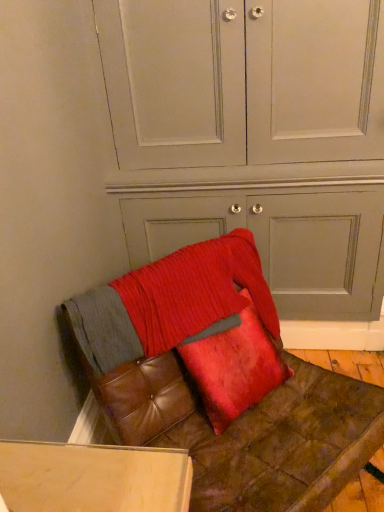
Question: From the image's perspective, is leather cushion at lower right below velvet red pillow at center?

Choices:
 (A) no
 (B) yes

Answer: (B)

Question: Does leather cushion at lower right have a greater width compared to velvet red pillow at center?

Choices:
 (A) no
 (B) yes

Answer: (B)

Question: Is velvet red pillow at center at the back of leather cushion at lower right?

Choices:
 (A) no
 (B) yes

Answer: (B)

Question: Can you confirm if leather cushion at lower right is taller than velvet red pillow at center?

Choices:
 (A) no
 (B) yes

Answer: (B)

Question: Is velvet red pillow at center a part of leather cushion at lower right?

Choices:
 (A) yes
 (B) no

Answer: (A)

Question: Considering the positions of point (221, 442) and point (375, 81), is point (221, 442) closer or farther from the camera than point (375, 81)?

Choices:
 (A) farther
 (B) closer

Answer: (B)

Question: Considering the positions of leather cushion at lower right and matte gray dresser at center in the image, is leather cushion at lower right wider or thinner than matte gray dresser at center?

Choices:
 (A) wide
 (B) thin

Answer: (A)

Question: Which is correct: leather cushion at lower right is inside matte gray dresser at center, or outside of it?

Choices:
 (A) inside
 (B) outside

Answer: (B)

Question: Relative to matte gray dresser at center, is leather cushion at lower right in front or behind?

Choices:
 (A) front
 (B) behind

Answer: (A)

Question: Does point (165, 431) appear closer or farther from the camera than point (211, 373)?

Choices:
 (A) farther
 (B) closer

Answer: (A)

Question: In terms of width, does leather cushion at lower right look wider or thinner when compared to velvet red pillow at center?

Choices:
 (A) wide
 (B) thin

Answer: (A)

Question: Relative to velvet red pillow at center, is leather cushion at lower right in front or behind?

Choices:
 (A) behind
 (B) front

Answer: (B)

Question: Which is correct: leather cushion at lower right is inside velvet red pillow at center, or outside of it?

Choices:
 (A) inside
 (B) outside

Answer: (B)

Question: Considering their positions, is velvet red pillow at center located in front of or behind leather cushion at lower right?

Choices:
 (A) behind
 (B) front

Answer: (A)

Question: Considering the positions of velvet red pillow at center and leather cushion at lower right in the image, is velvet red pillow at center taller or shorter than leather cushion at lower right?

Choices:
 (A) short
 (B) tall

Answer: (A)